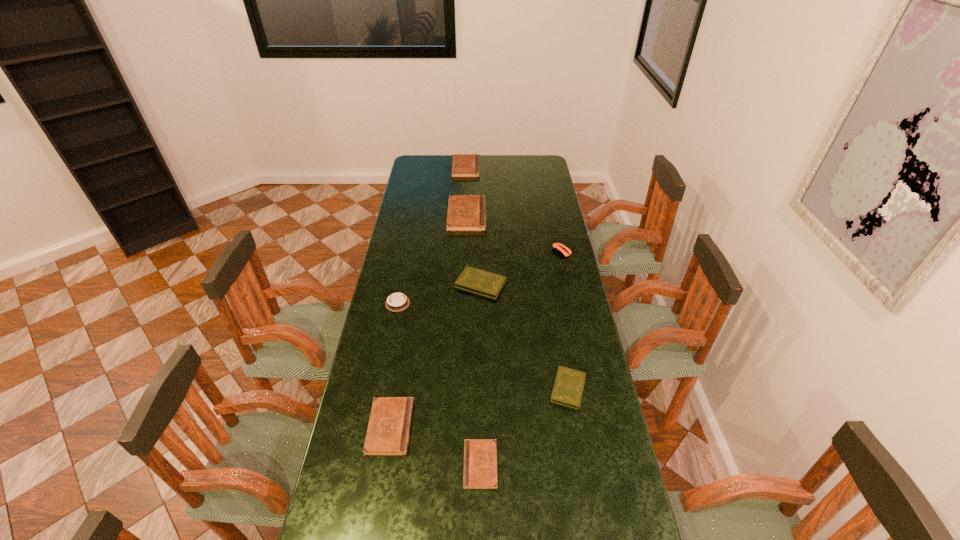
Identify the location of free point at the left edge. (407, 264).

Where is `vacant space at the right edge`? This screenshot has width=960, height=540. vacant space at the right edge is located at coordinates (587, 479).

You are a GUI agent. You are given a task and a screenshot of the screen. Output one action in this format:
    pyautogui.click(x=<x>, y=<y>)
    Task: Click on the vacant space at the far right corner of the desktop
    The height and width of the screenshot is (540, 960).
    Given the screenshot: What is the action you would take?
    pyautogui.click(x=522, y=168)

You are a GUI agent. You are given a task and a screenshot of the screen. Output one action in this format:
    pyautogui.click(x=<x>, y=<y>)
    Task: Click on the empty location between the smaller green diary and the sixth nearest object
    Image resolution: width=960 pixels, height=540 pixels.
    Given the screenshot: What is the action you would take?
    pyautogui.click(x=565, y=320)

The height and width of the screenshot is (540, 960). In order to click on free space between the smallest brown diary and the third smallest brown diary in this screenshot , I will do `click(473, 316)`.

In order to click on vacant point located between the chocolate cake and the smallest brown diary in this screenshot , I will do `click(439, 384)`.

Where is `vacant space that is in between the farthest brown diary and the smaller green diary`? This screenshot has height=540, width=960. vacant space that is in between the farthest brown diary and the smaller green diary is located at coordinates (517, 278).

Find the location of a particular element. This screenshot has width=960, height=540. blank region between the orange computer mouse and the biggest brown diary is located at coordinates (514, 233).

Locate an element on the screen. This screenshot has width=960, height=540. vacant area that lies between the nearer green diary and the third farthest object is located at coordinates (565, 320).

Find the location of a particular element. The width and height of the screenshot is (960, 540). free space between the chocolate cake and the smallest brown diary is located at coordinates (439, 384).